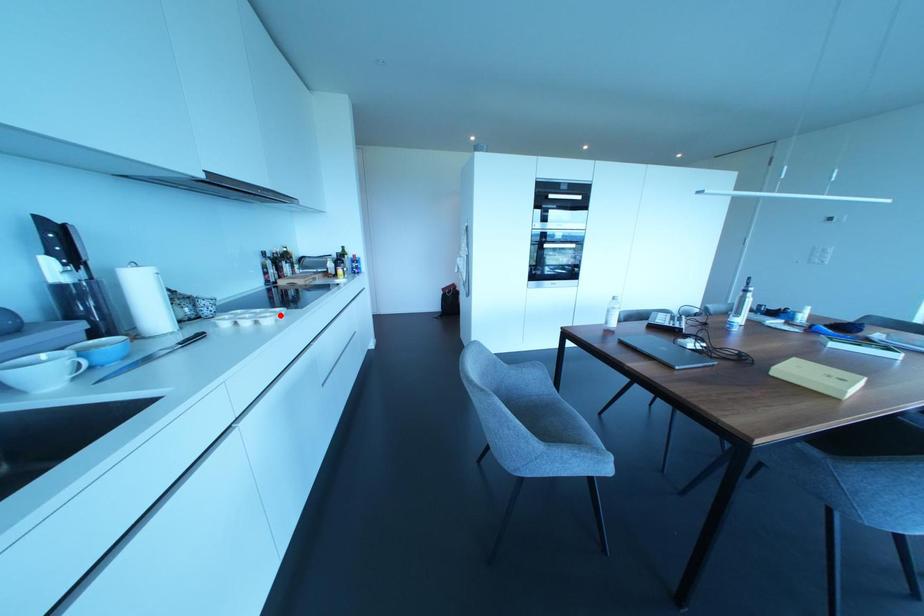
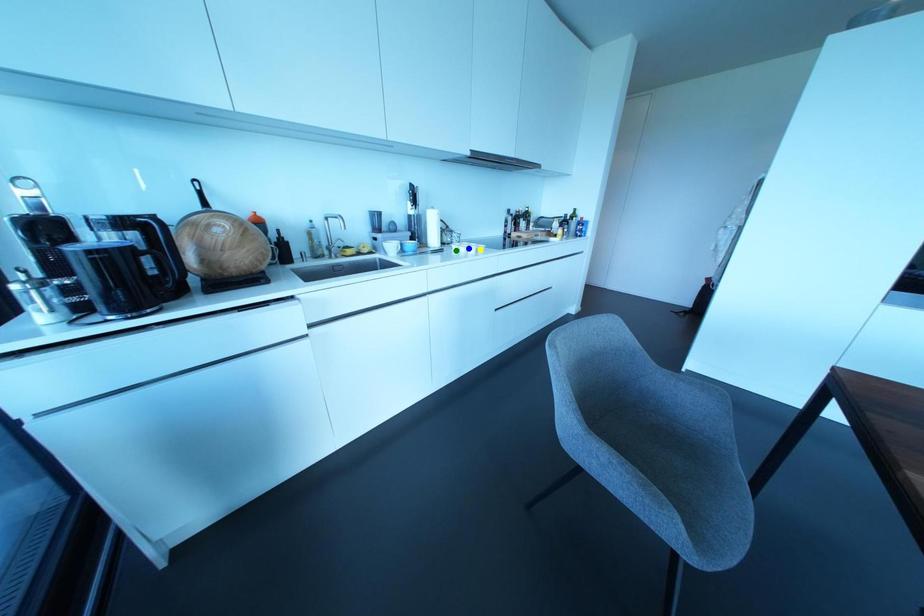
Question: I am providing you with two images of the same scene from different viewpoints. A red point is marked on the first image. You are given multiple points on the second image. Which point in image 2 represents the same 3d spot as the red point in image 1?

Choices:
 (A) blue point
 (B) yellow point
 (C) green point

Answer: (B)